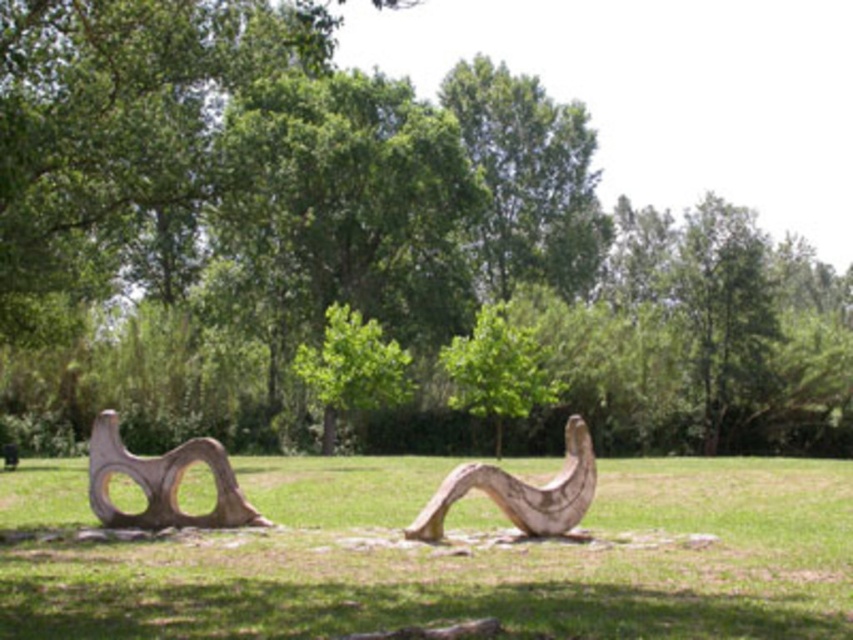
Can you confirm if green wood tree at center is shorter than green grass at center?

In fact, green wood tree at center may be taller than green grass at center.

What do you see at coordinates (363, 244) in the screenshot? This screenshot has height=640, width=853. I see `green wood tree at center` at bounding box center [363, 244].

Where is `green wood tree at center`? The height and width of the screenshot is (640, 853). green wood tree at center is located at coordinates (363, 244).

Does point (334, 493) come farther from viewer compared to point (381, 392)?

No, (334, 493) is in front of (381, 392).

Does green grass at center appear on the left side of green leafy tree at center?

In fact, green grass at center is to the right of green leafy tree at center.

The width and height of the screenshot is (853, 640). Find the location of `green grass at center`. green grass at center is located at coordinates (467, 561).

Can you confirm if green leafy tree at center is bigger than natural wood sculpture at center?

Yes.

Which is more to the left, green leafy tree at center or natural wood sculpture at center?

Positioned to the left is green leafy tree at center.

Between point (358, 326) and point (500, 474), which one is positioned in front?

Positioned in front is point (500, 474).

Find the location of `green leafy tree at center`. green leafy tree at center is located at coordinates click(x=352, y=368).